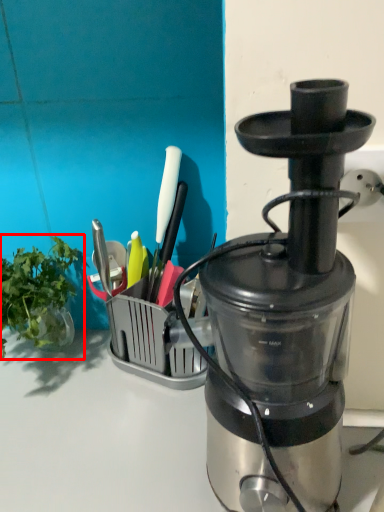
Question: Observing the image, what is the correct spatial positioning of vegetable (annotated by the red box) in reference to blender?

Choices:
 (A) left
 (B) right

Answer: (A)